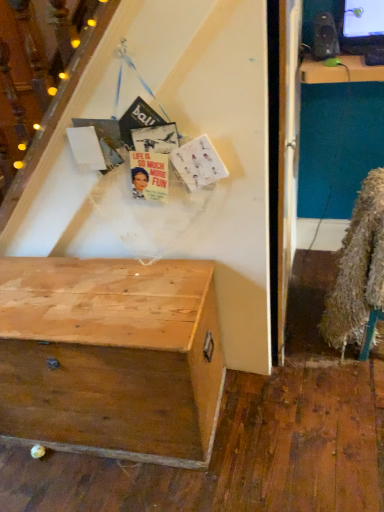
The image size is (384, 512). In order to click on free space above wooden chest at lower left (from a real-world perspective) in this screenshot , I will do `click(81, 295)`.